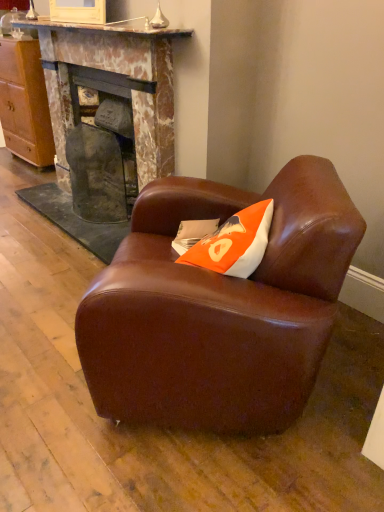
Where is `orange fabric pillow at center`? Image resolution: width=384 pixels, height=512 pixels. orange fabric pillow at center is located at coordinates (193, 233).

Find the location of a particular element. The height and width of the screenshot is (512, 384). brown leather armchair at center is located at coordinates (219, 308).

I want to click on marble fireplace at center, the 1th fireplace from the right, so click(x=105, y=127).

Describe the element at coordinates (105, 127) in the screenshot. I see `marble fireplace at center, the second fireplace positioned from the left` at that location.

Image resolution: width=384 pixels, height=512 pixels. Identify the location of orange fabric pillow at center. (193, 233).

From the image's perspective, would you say wooden cabinet at left is positioned over rustic stone fireplace at center, positioned as the first fireplace in left-to-right order?

Yes, from the image's perspective, wooden cabinet at left is above rustic stone fireplace at center, positioned as the first fireplace in left-to-right order.

Considering the relative sizes of wooden cabinet at left and rustic stone fireplace at center, arranged as the second fireplace when viewed from the right, in the image provided, is wooden cabinet at left thinner than rustic stone fireplace at center, arranged as the second fireplace when viewed from the right,?

No, wooden cabinet at left is not thinner than rustic stone fireplace at center, arranged as the second fireplace when viewed from the right.

Considering the sizes of objects wooden cabinet at left and rustic stone fireplace at center, positioned as the first fireplace in left-to-right order, in the image provided, who is shorter, wooden cabinet at left or rustic stone fireplace at center, positioned as the first fireplace in left-to-right order,?

rustic stone fireplace at center, positioned as the first fireplace in left-to-right order.

Find the location of `cabinetry above the orange fabric pillow at center (from the image's perspective)`. cabinetry above the orange fabric pillow at center (from the image's perspective) is located at coordinates (25, 102).

Can you confirm if wooden cabinet at left is positioned to the right of orange fabric pillow at center?

No.

Is wooden cabinet at left not close to orange fabric pillow at center?

wooden cabinet at left is far away from orange fabric pillow at center.

From a real-world perspective, between rustic stone fireplace at center, arranged as the second fireplace when viewed from the right, and orange fabric pillow at center, who is vertically higher?

orange fabric pillow at center.

From the image's perspective, is rustic stone fireplace at center, arranged as the second fireplace when viewed from the right, above or below orange fabric pillow at center?

rustic stone fireplace at center, arranged as the second fireplace when viewed from the right, is situated higher than orange fabric pillow at center in the image.

Which of these two, rustic stone fireplace at center, positioned as the first fireplace in left-to-right order, or orange fabric pillow at center, is bigger?

Bigger between the two is rustic stone fireplace at center, positioned as the first fireplace in left-to-right order.

Is rustic stone fireplace at center, positioned as the first fireplace in left-to-right order, wider than orange fabric pillow at center?

Indeed, rustic stone fireplace at center, positioned as the first fireplace in left-to-right order, has a greater width compared to orange fabric pillow at center.

From the image's perspective, does brown leather armchair at center appear lower than orange fabric pillow at center?

Yes, from the image's perspective, brown leather armchair at center is below orange fabric pillow at center.

Looking at this image, which is farther from the camera, (188, 291) or (204, 234)?

Point (204, 234)

From a real-world perspective, is brown leather armchair at center located beneath orange fabric pillow at center?

Indeed, from a real-world perspective, brown leather armchair at center is positioned beneath orange fabric pillow at center.

From the image's perspective, is brown leather armchair at center located above marble fireplace at center, the second fireplace positioned from the left?

No, from the image's perspective, brown leather armchair at center is not above marble fireplace at center, the second fireplace positioned from the left.

Can you confirm if brown leather armchair at center is taller than marble fireplace at center, the 1th fireplace from the right?

No.

Based on the photo, is brown leather armchair at center placed right next to marble fireplace at center, the 1th fireplace from the right?

brown leather armchair at center and marble fireplace at center, the 1th fireplace from the right, are not in contact.

From the image's perspective, is marble fireplace at center, the 1th fireplace from the right, beneath rustic stone fireplace at center, arranged as the second fireplace when viewed from the right?

Incorrect, from the image's perspective, marble fireplace at center, the 1th fireplace from the right, is higher than rustic stone fireplace at center, arranged as the second fireplace when viewed from the right.

Could you tell me if marble fireplace at center, the 1th fireplace from the right, is facing rustic stone fireplace at center, positioned as the first fireplace in left-to-right order?

Yes, marble fireplace at center, the 1th fireplace from the right, is aimed at rustic stone fireplace at center, positioned as the first fireplace in left-to-right order.

Which is behind, point (118, 122) or point (77, 114)?

The point (77, 114) is more distant.

How many degrees apart are the facing directions of marble fireplace at center, the 1th fireplace from the right, and rustic stone fireplace at center, arranged as the second fireplace when viewed from the right?

0.274 degrees.

Considering the sizes of rustic stone fireplace at center, arranged as the second fireplace when viewed from the right, and wooden cabinet at left in the image, is rustic stone fireplace at center, arranged as the second fireplace when viewed from the right, taller or shorter than wooden cabinet at left?

Clearly, rustic stone fireplace at center, arranged as the second fireplace when viewed from the right, is shorter compared to wooden cabinet at left.

Which object is positioned more to the right, rustic stone fireplace at center, positioned as the first fireplace in left-to-right order, or wooden cabinet at left?

rustic stone fireplace at center, positioned as the first fireplace in left-to-right order, is more to the right.

From the image's perspective, between rustic stone fireplace at center, arranged as the second fireplace when viewed from the right, and wooden cabinet at left, who is located below?

From the image's view, rustic stone fireplace at center, arranged as the second fireplace when viewed from the right, is below.

Locate an element on the screen. cabinetry on the left of rustic stone fireplace at center, positioned as the first fireplace in left-to-right order is located at coordinates (25, 102).

The height and width of the screenshot is (512, 384). There is a wooden cabinet at left. Identify the location of the 2nd fireplace below it (from the image's perspective). (102, 149).

This screenshot has height=512, width=384. I want to click on pillow in front of the wooden cabinet at left, so click(x=193, y=233).

Considering their positions, is rustic stone fireplace at center, positioned as the first fireplace in left-to-right order, positioned closer to brown leather armchair at center than marble fireplace at center, the 1th fireplace from the right?

marble fireplace at center, the 1th fireplace from the right, lies closer to brown leather armchair at center than the other object.

When comparing their distances from rustic stone fireplace at center, positioned as the first fireplace in left-to-right order, does marble fireplace at center, the 1th fireplace from the right, or brown leather armchair at center seem further?

Based on the image, brown leather armchair at center appears to be further to rustic stone fireplace at center, positioned as the first fireplace in left-to-right order.

Based on the photo, considering their positions, is orange fabric pillow at center positioned closer to brown leather armchair at center than wooden cabinet at left?

Based on the image, orange fabric pillow at center appears to be nearer to brown leather armchair at center.

Considering their positions, is wooden cabinet at left positioned closer to brown leather armchair at center than rustic stone fireplace at center, arranged as the second fireplace when viewed from the right?

Based on the image, rustic stone fireplace at center, arranged as the second fireplace when viewed from the right, appears to be nearer to brown leather armchair at center.

Looking at the image, which one is located closer to rustic stone fireplace at center, arranged as the second fireplace when viewed from the right, wooden cabinet at left or marble fireplace at center, the second fireplace positioned from the left?

marble fireplace at center, the second fireplace positioned from the left.

Considering their positions, is marble fireplace at center, the second fireplace positioned from the left, positioned closer to rustic stone fireplace at center, positioned as the first fireplace in left-to-right order, than orange fabric pillow at center?

marble fireplace at center, the second fireplace positioned from the left, is positioned closer to the anchor rustic stone fireplace at center, positioned as the first fireplace in left-to-right order.

Estimate the real-world distances between objects in this image. Which object is closer to marble fireplace at center, the second fireplace positioned from the left, rustic stone fireplace at center, positioned as the first fireplace in left-to-right order, or wooden cabinet at left?

rustic stone fireplace at center, positioned as the first fireplace in left-to-right order, lies closer to marble fireplace at center, the second fireplace positioned from the left, than the other object.

In the scene shown: Looking at the image, which one is located further to rustic stone fireplace at center, arranged as the second fireplace when viewed from the right, brown leather armchair at center or marble fireplace at center, the second fireplace positioned from the left?

Among the two, brown leather armchair at center is located further to rustic stone fireplace at center, arranged as the second fireplace when viewed from the right.

I want to click on pillow positioned between brown leather armchair at center and wooden cabinet at left from near to far, so click(x=193, y=233).

I want to click on pillow between brown leather armchair at center and rustic stone fireplace at center, arranged as the second fireplace when viewed from the right, in the front-back direction, so click(193, 233).

Locate an element on the screen. fireplace between marble fireplace at center, the 1th fireplace from the right, and orange fabric pillow at center, in the vertical direction is located at coordinates (102, 149).

Identify the location of pillow between brown leather armchair at center and marble fireplace at center, the second fireplace positioned from the left, in the front-back direction. The height and width of the screenshot is (512, 384). (193, 233).